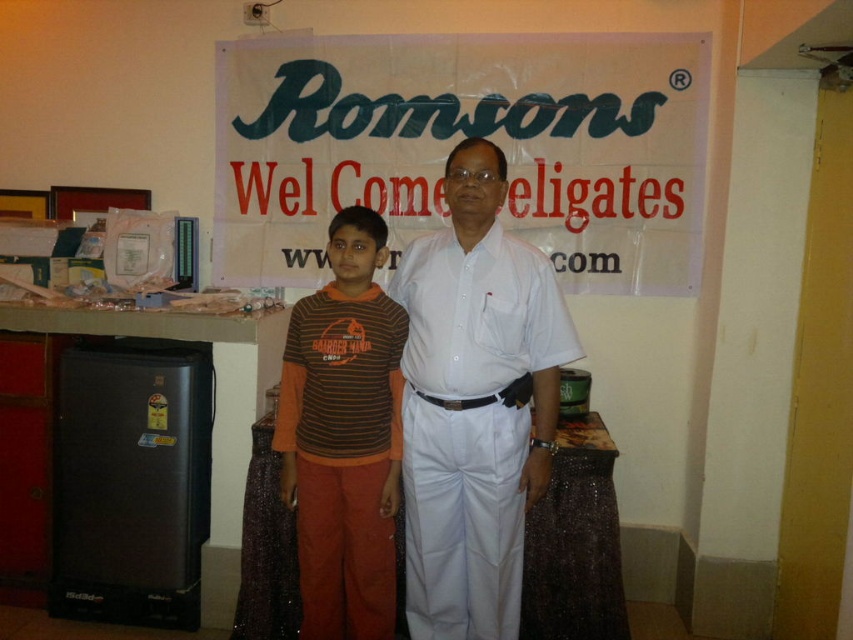
In order to click on white cotton shirt at center in this screenshot , I will do `click(474, 403)`.

Does white cotton shirt at center come behind brown striped shirt at center?

No, it is not.

This screenshot has width=853, height=640. What are the coordinates of `white cotton shirt at center` in the screenshot? It's located at (474, 403).